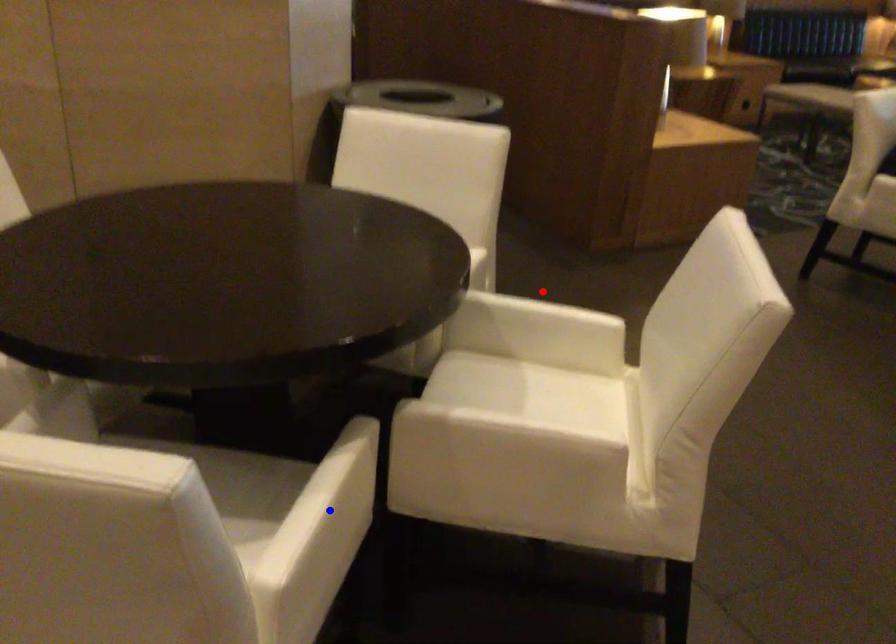
Question: In the image, two points are highlighted. Which point is nearer to the camera? Reply with the corresponding letter.

Choices:
 (A) blue point
 (B) red point

Answer: (A)